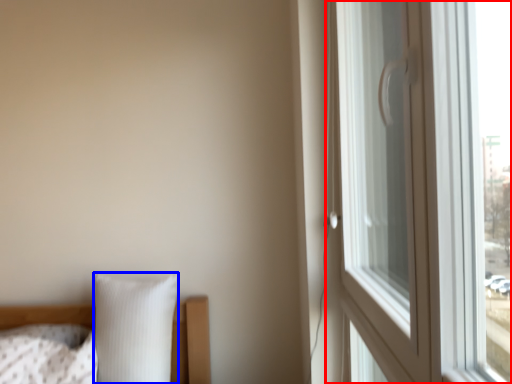
Question: Which object is further to the camera taking this photo, window (highlighted by a red box) or pillow (highlighted by a blue box)?

Choices:
 (A) window
 (B) pillow

Answer: (B)